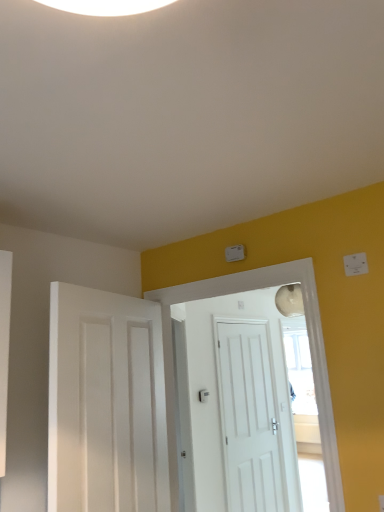
Question: Is white matte door at left, marked as the 3th door in a back-to-front arrangement, wider or thinner than white matte door at center, marked as the first door in a back-to-front arrangement?

Choices:
 (A) wide
 (B) thin

Answer: (A)

Question: Is white matte door at left, which is the first door in front-to-back order, spatially inside white matte door at center, arranged as the third door when viewed from the front, or outside of it?

Choices:
 (A) inside
 (B) outside

Answer: (B)

Question: Which object is positioned farthest from the white matte door at left, marked as the 3th door in a back-to-front arrangement?

Choices:
 (A) white matte door at center, acting as the second door starting from the front
 (B) white matte door at center, arranged as the third door when viewed from the front
 (C) white plastic light switch at upper right

Answer: (B)

Question: Which object is positioned closest to the white matte door at center, acting as the second door starting from the front?

Choices:
 (A) white matte door at left, which is the first door in front-to-back order
 (B) white matte door at center, arranged as the third door when viewed from the front
 (C) white plastic light switch at upper right

Answer: (A)